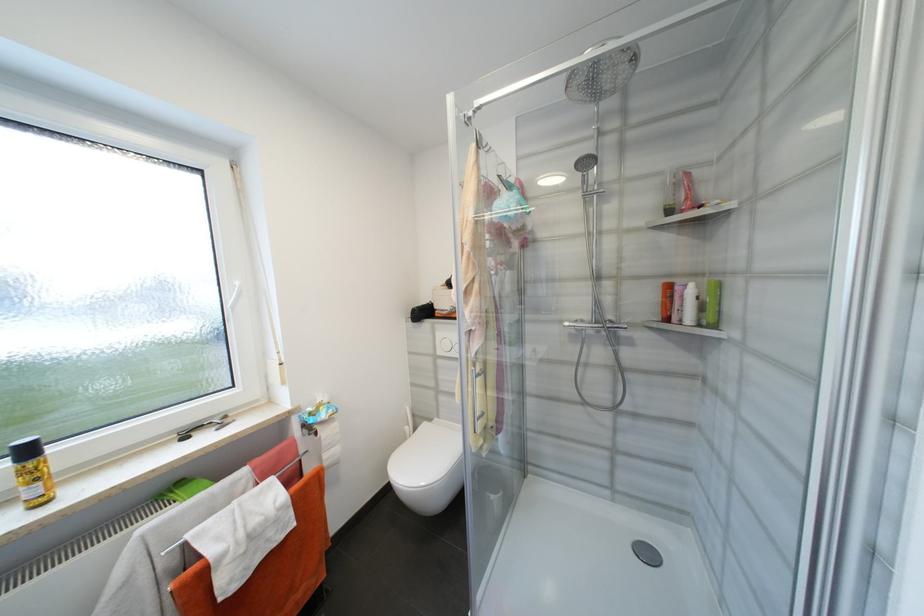
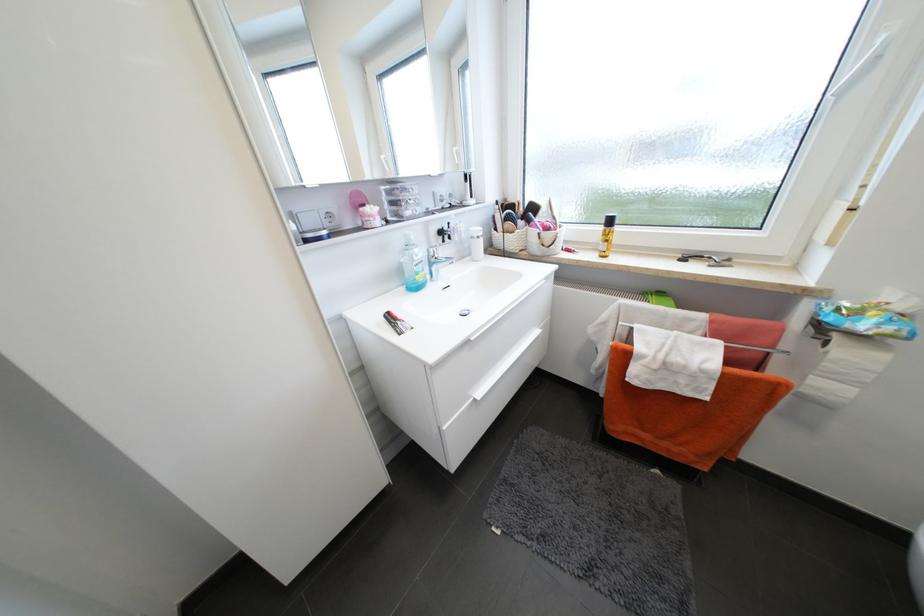
Locate, in the second image, the point that corresponds to the point at 242,285 in the first image.

(888, 41)